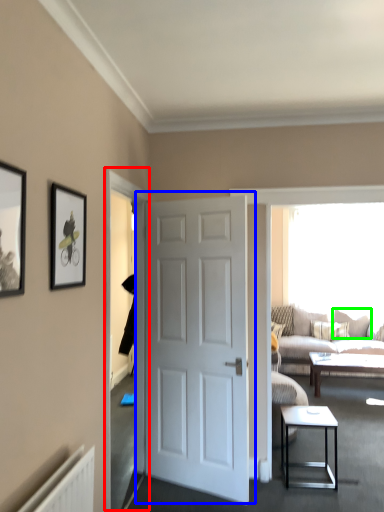
Question: Based on their relative distances, which object is nearer to glass door (highlighted by a red box)? Choose from door (highlighted by a blue box) and pillow (highlighted by a green box).

Choices:
 (A) door
 (B) pillow

Answer: (A)